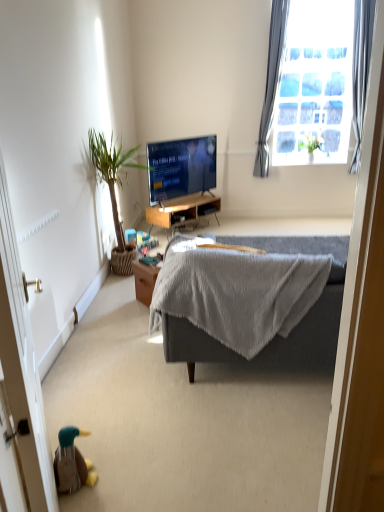
The height and width of the screenshot is (512, 384). Describe the element at coordinates (181, 167) in the screenshot. I see `matte black tv at center` at that location.

The height and width of the screenshot is (512, 384). What do you see at coordinates (22, 366) in the screenshot?
I see `brown wooden screen door at lower left` at bounding box center [22, 366].

Describe the element at coordinates (112, 188) in the screenshot. I see `green leafy plant at left, placed as the first houseplant when sorted from front to back` at that location.

This screenshot has width=384, height=512. I want to click on matte black tv at center, so click(181, 167).

This screenshot has width=384, height=512. I want to click on screen door that appears below the green leafy plant at left, placed as the first houseplant when sorted from front to back (from the image's perspective), so click(22, 366).

From a real-world perspective, which object stands above the other?

brown wooden screen door at lower left is physically above.

Between brown wooden screen door at lower left and green leafy plant at left, which is the 2th houseplant from top to bottom, which one has larger size?

Bigger between the two is green leafy plant at left, which is the 2th houseplant from top to bottom.

Which object is wider, brown wooden screen door at lower left or green leafy plant at left, arranged as the second houseplant when viewed from the back?

green leafy plant at left, arranged as the second houseplant when viewed from the back, is wider.

Is gray fabric couch at center completely or partially outside of brown wooden screen door at lower left?

Yes, gray fabric couch at center is not within brown wooden screen door at lower left.

Is point (294, 330) closer or farther from the camera than point (30, 506)?

Point (294, 330) is farther from the camera than point (30, 506).

Which object is positioned more to the left, gray fabric couch at center or brown wooden screen door at lower left?

brown wooden screen door at lower left is more to the left.

From the image's perspective, who appears lower, gray fabric couch at center or brown wooden screen door at lower left?

From the image's view, brown wooden screen door at lower left is below.

Between green leafy plant at upper right, the first houseplant viewed from the back, and satin gray curtain at upper right, which ranks as the first curtain in left-to-right order, which one has more height?

Standing taller between the two is satin gray curtain at upper right, which ranks as the first curtain in left-to-right order.

There is a green leafy plant at upper right, positioned as the 2th houseplant in left-to-right order. Where is `the 2nd curtain above it (from the image's perspective)`? The height and width of the screenshot is (512, 384). the 2nd curtain above it (from the image's perspective) is located at coordinates (271, 82).

From a real-world perspective, is green leafy plant at upper right, the first houseplant viewed from the back, above or below satin gray curtain at upper right, the 2th curtain when ordered from right to left?

In terms of real-world spatial position, green leafy plant at upper right, the first houseplant viewed from the back, is below satin gray curtain at upper right, the 2th curtain when ordered from right to left.

Is satin gray curtain at upper right, the 2th curtain when ordered from right to left, at the back of green leafy plant at upper right, placed as the second houseplant when sorted from bottom to top?

That's not correct — green leafy plant at upper right, placed as the second houseplant when sorted from bottom to top, is not looking away from satin gray curtain at upper right, the 2th curtain when ordered from right to left.

Considering the relative positions of brown wooden screen door at lower left and gray fabric curtain at upper right, the 2th curtain from the left, in the image provided, is brown wooden screen door at lower left behind gray fabric curtain at upper right, the 2th curtain from the left,?

No, brown wooden screen door at lower left is in front of gray fabric curtain at upper right, the 2th curtain from the left.

Is brown wooden screen door at lower left shorter than gray fabric curtain at upper right, the 2th curtain from the left?

Indeed, brown wooden screen door at lower left has a lesser height compared to gray fabric curtain at upper right, the 2th curtain from the left.

Can you tell me how much brown wooden screen door at lower left and gray fabric curtain at upper right, the first curtain when ordered from right to left, differ in facing direction?

114 degrees separate the facing orientations of brown wooden screen door at lower left and gray fabric curtain at upper right, the first curtain when ordered from right to left.

Considering the sizes of objects brown wooden screen door at lower left and gray fabric curtain at upper right, the first curtain when ordered from right to left, in the image provided, who is smaller, brown wooden screen door at lower left or gray fabric curtain at upper right, the first curtain when ordered from right to left,?

Smaller between the two is gray fabric curtain at upper right, the first curtain when ordered from right to left.

From the image's perspective, between green leafy plant at left, placed as the first houseplant when sorted from front to back, and gray fabric curtain at upper right, the first curtain when ordered from right to left, who is located below?

green leafy plant at left, placed as the first houseplant when sorted from front to back, from the image's perspective.

Which object is closer to the camera, green leafy plant at left, which is the 2th houseplant from top to bottom, or gray fabric curtain at upper right, the 2th curtain from the left?

green leafy plant at left, which is the 2th houseplant from top to bottom.

Is point (112, 155) behind point (373, 0)?

Yes.

Is green leafy plant at left, which is the 2th houseplant from top to bottom, oriented away from gray fabric curtain at upper right, the first curtain when ordered from right to left?

No, gray fabric curtain at upper right, the first curtain when ordered from right to left, is not at the back of green leafy plant at left, which is the 2th houseplant from top to bottom.

Choose the correct answer: Is green leafy plant at upper right, positioned as the 2th houseplant in left-to-right order, inside gray fabric curtain at upper right, the first curtain when ordered from right to left, or outside it?

green leafy plant at upper right, positioned as the 2th houseplant in left-to-right order, exists outside the volume of gray fabric curtain at upper right, the first curtain when ordered from right to left.

Which of these two, green leafy plant at upper right, placed as the second houseplant when sorted from bottom to top, or gray fabric curtain at upper right, the first curtain when ordered from right to left, stands taller?

gray fabric curtain at upper right, the first curtain when ordered from right to left.

Is green leafy plant at upper right, which is the second houseplant from front to back, aimed at gray fabric curtain at upper right, the 2th curtain from the left?

No, green leafy plant at upper right, which is the second houseplant from front to back, is not turned towards gray fabric curtain at upper right, the 2th curtain from the left.

Consider the image. Is green leafy plant at upper right, which is the second houseplant from front to back, placed right next to gray fabric curtain at upper right, the first curtain when ordered from right to left?

No, green leafy plant at upper right, which is the second houseplant from front to back, is not with gray fabric curtain at upper right, the first curtain when ordered from right to left.

In terms of height, does green leafy plant at left, which is the 2th houseplant from top to bottom, look taller or shorter compared to brown wooden screen door at lower left?

Clearly, green leafy plant at left, which is the 2th houseplant from top to bottom, is shorter compared to brown wooden screen door at lower left.

Could you tell me if green leafy plant at left, which is the 2th houseplant from top to bottom, is turned towards brown wooden screen door at lower left?

No, green leafy plant at left, which is the 2th houseplant from top to bottom, is not oriented towards brown wooden screen door at lower left.

Is green leafy plant at left, which is the 2th houseplant from top to bottom, bigger than brown wooden screen door at lower left?

Correct, green leafy plant at left, which is the 2th houseplant from top to bottom, is larger in size than brown wooden screen door at lower left.

Locate an element on the screen. The height and width of the screenshot is (512, 384). screen door on the right of the green leafy plant at left, which is the 2th houseplant from top to bottom is located at coordinates (22, 366).

Find the location of a particular element. The height and width of the screenshot is (512, 384). the 1st houseplant behind when counting from the brown wooden screen door at lower left is located at coordinates (112, 188).

I want to click on screen door on the left of gray fabric couch at center, so click(x=22, y=366).

When comparing their distances from satin gray curtain at upper right, which ranks as the first curtain in left-to-right order, does gray fabric couch at center or gray fabric curtain at upper right, the first curtain when ordered from right to left, seem closer?

gray fabric curtain at upper right, the first curtain when ordered from right to left, is positioned closer to the anchor satin gray curtain at upper right, which ranks as the first curtain in left-to-right order.

Estimate the real-world distances between objects in this image. Which object is further from satin gray curtain at upper right, the 2th curtain when ordered from right to left, wooden desk at center or gray fabric couch at center?

Among the two, gray fabric couch at center is located further to satin gray curtain at upper right, the 2th curtain when ordered from right to left.

Considering their positions, is gray fabric curtain at upper right, the 2th curtain from the left, positioned closer to satin gray curtain at upper right, the 2th curtain when ordered from right to left, than wooden desk at center?

The object closer to satin gray curtain at upper right, the 2th curtain when ordered from right to left, is gray fabric curtain at upper right, the 2th curtain from the left.

Which object lies further to the anchor point green leafy plant at left, arranged as the first houseplant when ordered from the bottom, matte black tv at center or gray fabric couch at center?

gray fabric couch at center is positioned further to the anchor green leafy plant at left, arranged as the first houseplant when ordered from the bottom.

Estimate the real-world distances between objects in this image. Which object is closer to gray fabric curtain at upper right, the first curtain when ordered from right to left, brown wooden screen door at lower left or wooden desk at center?

wooden desk at center is closer to gray fabric curtain at upper right, the first curtain when ordered from right to left.

Based on their spatial positions, is gray fabric curtain at upper right, the first curtain when ordered from right to left, or wooden desk at center closer to green leafy plant at left, arranged as the first houseplant when ordered from the bottom?

wooden desk at center is closer to green leafy plant at left, arranged as the first houseplant when ordered from the bottom.

Looking at the image, which one is located closer to brown wooden screen door at lower left, matte black tv at center or wooden desk at center?

Based on the image, wooden desk at center appears to be nearer to brown wooden screen door at lower left.

Considering their positions, is satin gray curtain at upper right, which ranks as the first curtain in left-to-right order, positioned further to gray fabric couch at center than gray fabric curtain at upper right, the 2th curtain from the left?

gray fabric curtain at upper right, the 2th curtain from the left, is positioned further to the anchor gray fabric couch at center.

At what (x,y) coordinates should I click in order to perform the action: click on studio couch between brown wooden screen door at lower left and matte black tv at center in the front-back direction. Please return your answer as a coordinate pair (x, y). The image size is (384, 512). Looking at the image, I should click on (276, 334).

Identify the location of television between green leafy plant at left, arranged as the first houseplant when ordered from the bottom, and green leafy plant at upper right, which is the second houseplant from front to back, from left to right. The width and height of the screenshot is (384, 512). (181, 167).

Where is `desk between brown wooden screen door at lower left and satin gray curtain at upper right, which ranks as the first curtain in left-to-right order, along the z-axis`? The image size is (384, 512). desk between brown wooden screen door at lower left and satin gray curtain at upper right, which ranks as the first curtain in left-to-right order, along the z-axis is located at coordinates (183, 211).

At what (x,y) coordinates should I click in order to perform the action: click on houseplant between gray fabric couch at center and green leafy plant at upper right, acting as the first houseplant starting from the right, from front to back. Please return your answer as a coordinate pair (x, y). Looking at the image, I should click on (112, 188).